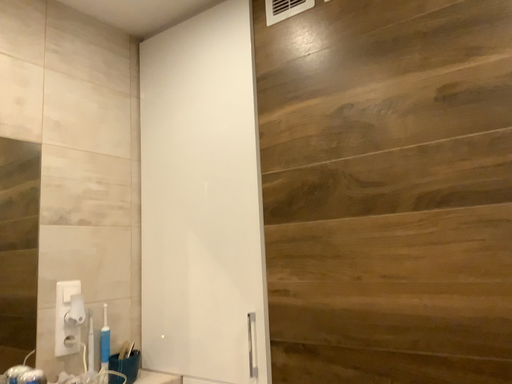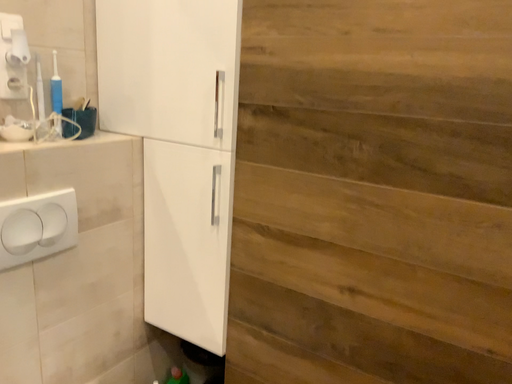
Question: Which way did the camera rotate in the video?

Choices:
 (A) rotated upward
 (B) rotated downward

Answer: (B)